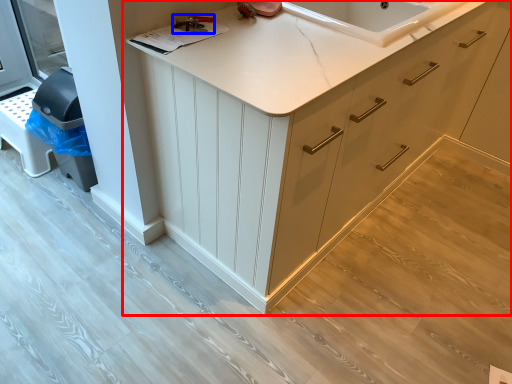
Question: Which object appears farthest to the camera in this image, cabinetry (highlighted by a red box) or tool (highlighted by a blue box)?

Choices:
 (A) cabinetry
 (B) tool

Answer: (B)